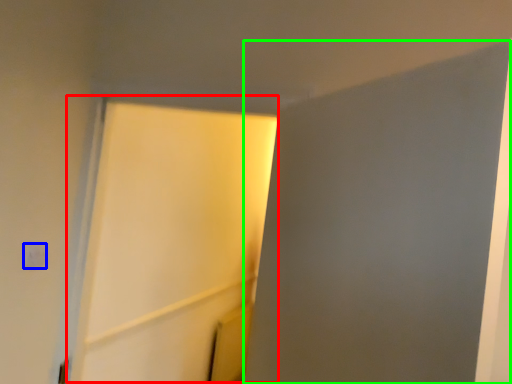
Question: Considering the real-world distances, which object is farthest from screen door (highlighted by a red box)? light switch (highlighted by a blue box) or screen door (highlighted by a green box)?

Choices:
 (A) light switch
 (B) screen door

Answer: (A)